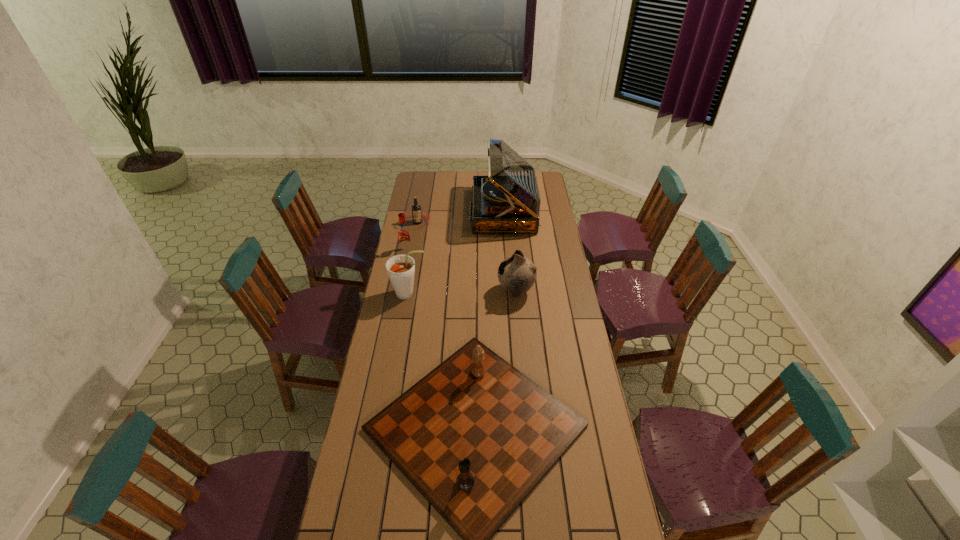
Where is `the tallest object`? the tallest object is located at coordinates (506, 201).

Where is `pottery`? This screenshot has width=960, height=540. pottery is located at coordinates (516, 274).

Find the location of `the nearest root beer`. the nearest root beer is located at coordinates (400, 268).

Where is `the fourth nearest object`? the fourth nearest object is located at coordinates (404, 237).

Find the location of a particular element. This screenshot has height=540, width=960. the farthest root beer is located at coordinates (416, 208).

This screenshot has width=960, height=540. Find the location of `blank space located 0.330m on the front-facing side of the tallest object`. blank space located 0.330m on the front-facing side of the tallest object is located at coordinates (413, 211).

Image resolution: width=960 pixels, height=540 pixels. In order to click on vacant space located 0.350m on the front-facing side of the tallest object in this screenshot , I will do `click(409, 211)`.

I want to click on vacant point located on the front-facing side of the tallest object, so click(458, 211).

This screenshot has height=540, width=960. What are the coordinates of `vacant space located from the spout of the pottery` in the screenshot? It's located at (467, 291).

Where is `free space located 0.130m from the spout of the pottery`? The width and height of the screenshot is (960, 540). free space located 0.130m from the spout of the pottery is located at coordinates (469, 291).